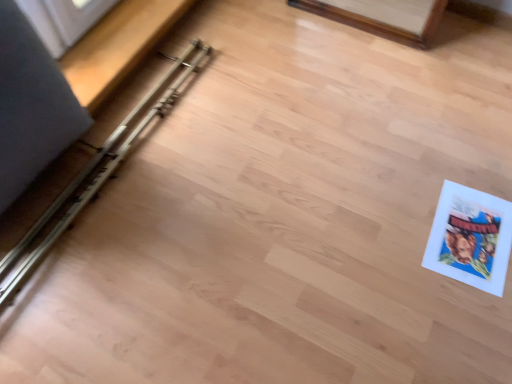
Locate an element on the screen. free spot to the right of metallic silver rail at left is located at coordinates (286, 155).